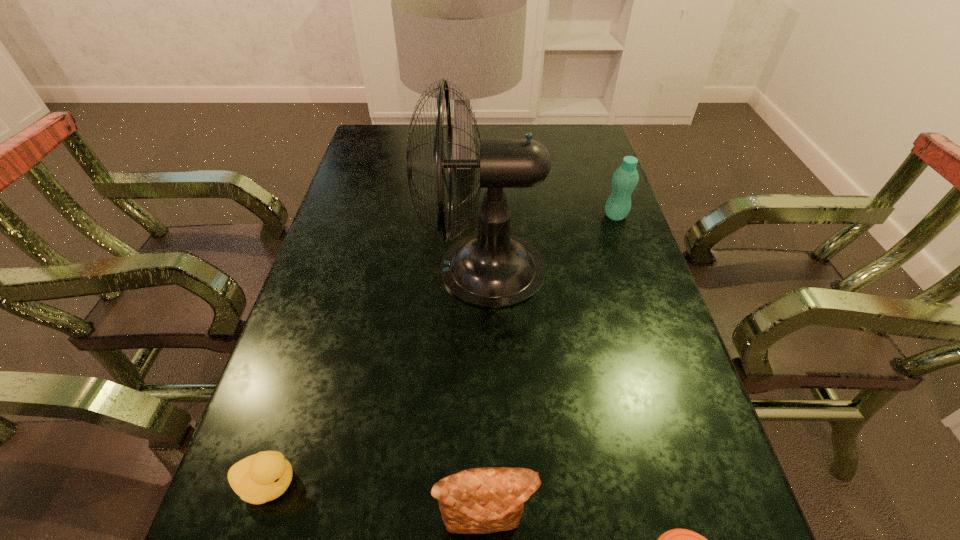
Locate which object ranks second in proximity to the second object from right to left. Please provide its 2D coordinates. Your answer should be formatted as a tuple, i.e. [(x, y)], where the tuple contains the x and y coordinates of a point satisfying the conditions above.

[(492, 269)]

At what (x,y) coordinates should I click in order to perform the action: click on vacant region that satisfies the following two spatial constraints: 1. on the front-facing side of the lampshade; 2. on the right side of the second farthest object. Please return your answer as a coordinate pair (x, y). Looking at the image, I should click on (462, 215).

At what (x,y) coordinates should I click in order to perform the action: click on blank space that satisfies the following two spatial constraints: 1. on the front-facing side of the farthest object; 2. on the right side of the second farthest object. Please return your answer as a coordinate pair (x, y). Image resolution: width=960 pixels, height=540 pixels. Looking at the image, I should click on 462,215.